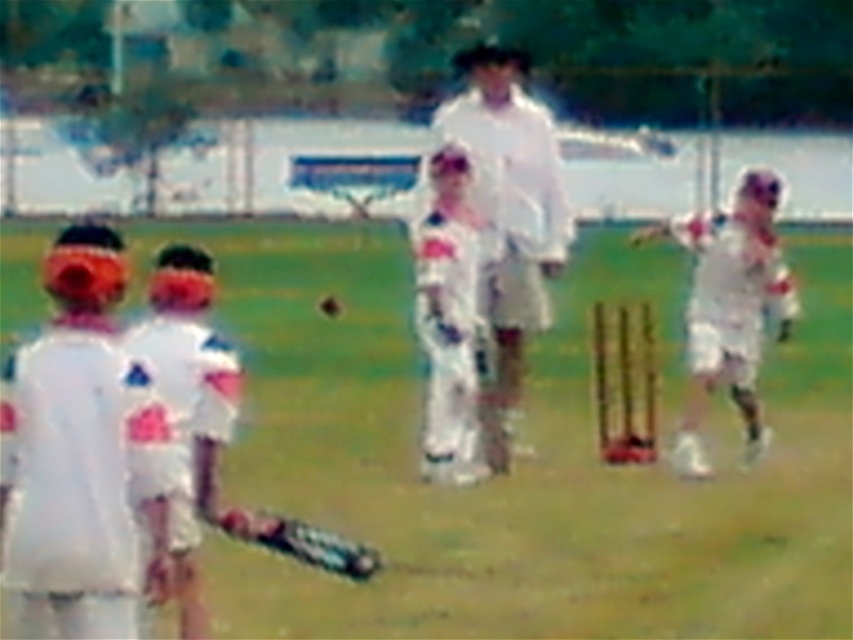
Question: Where is white fabric bat at center located in relation to white matte cricket bat at left in the image?

Choices:
 (A) below
 (B) above

Answer: (B)

Question: Which point is closer to the camera taking this photo?

Choices:
 (A) pos(456,97)
 (B) pos(497,627)
 (C) pos(85,572)

Answer: (C)

Question: In this image, where is white fabric bat at center located relative to white matte cricket bat at left?

Choices:
 (A) right
 (B) left

Answer: (A)

Question: Which of the following is the farthest from the observer?

Choices:
 (A) (537, 232)
 (B) (16, 422)
 (C) (633, 493)

Answer: (A)

Question: Considering the real-world distances, which object is closest to the white matte cricket bat at left?

Choices:
 (A) white matte cricket uniform at center
 (B) white fabric bat at center

Answer: (A)

Question: In this image, where is white matte cricket bat at left located relative to white matte cricket uniform at center?

Choices:
 (A) right
 (B) left

Answer: (B)